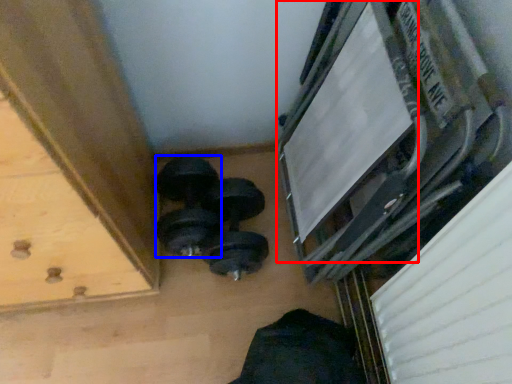
Question: Which object appears farthest to the camera in this image, window frame (highlighted by a red box) or dumbbell (highlighted by a blue box)?

Choices:
 (A) window frame
 (B) dumbbell

Answer: (B)